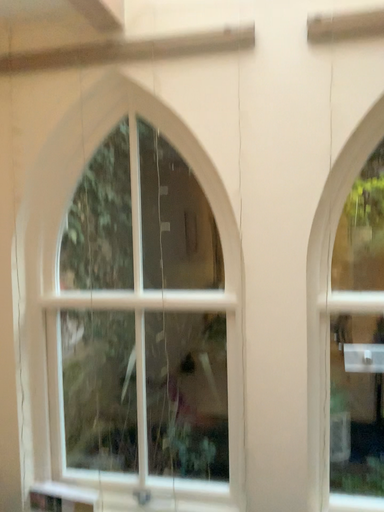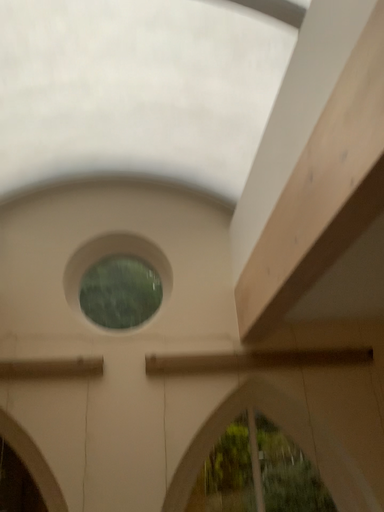
Question: How did the camera likely rotate when shooting the video?

Choices:
 (A) rotated downward
 (B) rotated upward

Answer: (B)